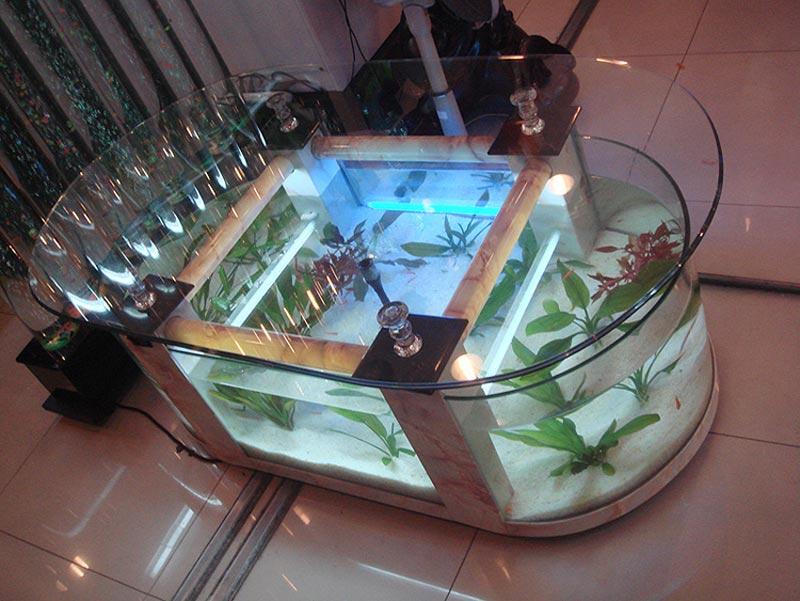
The image size is (800, 601). I want to click on white tile floor, so click(777, 162).